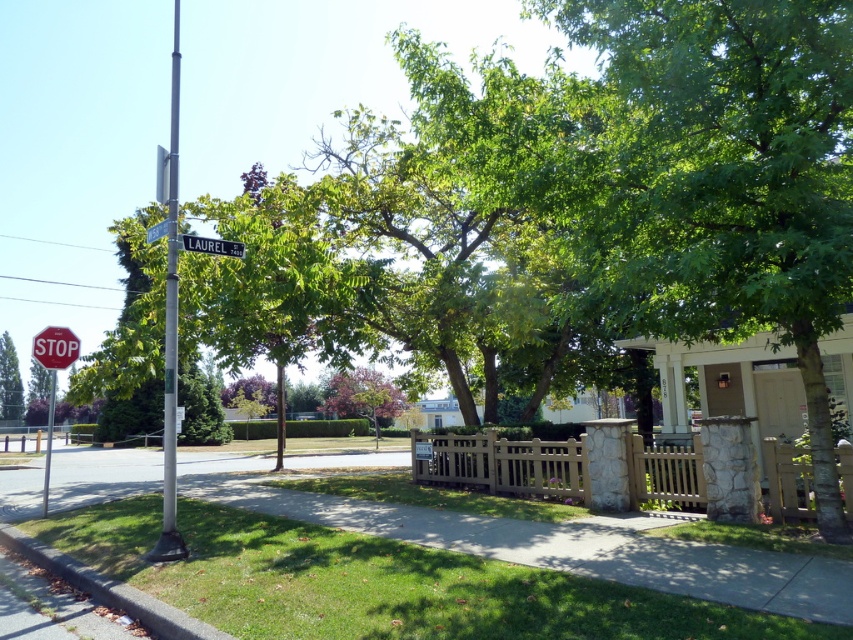
You are a pedestrian standing at the edge of the sidewalk and want to walk towards the stop sign on the left side. Which object, the green grass at lower left or the green leafy tree at left, would you encounter first?

You would encounter the green grass at lower left first because it is positioned to the right of the green leafy tree at left, meaning it is closer to your starting point on the sidewalk.

You are standing at the point marked as point (550, 541) in the image. What object is directly in front of you?

The green grass at lower left is located at point 0.847, 0.647, so the object directly in front of you is the green grass at lower left.

You are standing on the sidewalk and want to take a photo of the green grass at lower left and the green leafy tree at left. Which object should you focus on first to ensure both are in focus?

Since the green grass at lower left is closer to the viewer than the green leafy tree at left, you should focus on the green leafy tree at left first to ensure both are in focus.